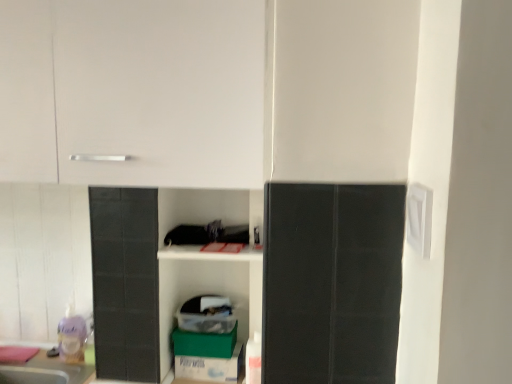
Question: Is white matte cabinet at upper left beside translucent plastic toy at lower left?

Choices:
 (A) yes
 (B) no

Answer: (B)

Question: From a real-world perspective, is white matte cabinet at upper left on top of translucent plastic toy at lower left?

Choices:
 (A) no
 (B) yes

Answer: (B)

Question: Does white matte cabinet at upper left have a lesser height compared to translucent plastic toy at lower left?

Choices:
 (A) yes
 (B) no

Answer: (B)

Question: Could you tell me if white matte cabinet at upper left is facing translucent plastic toy at lower left?

Choices:
 (A) yes
 (B) no

Answer: (B)

Question: Is white matte cabinet at upper left further to camera compared to translucent plastic toy at lower left?

Choices:
 (A) yes
 (B) no

Answer: (B)

Question: Looking at the image, does translucent plastic toy at lower left seem bigger or smaller compared to white matte cabinet at upper left?

Choices:
 (A) big
 (B) small

Answer: (B)

Question: Is translucent plastic toy at lower left in front of or behind white matte cabinet at upper left in the image?

Choices:
 (A) front
 (B) behind

Answer: (B)

Question: Considering the positions of point (72, 312) and point (103, 89), is point (72, 312) closer or farther from the camera than point (103, 89)?

Choices:
 (A) farther
 (B) closer

Answer: (A)

Question: Visually, is translucent plastic toy at lower left positioned to the left or to the right of white matte cabinet at upper left?

Choices:
 (A) right
 (B) left

Answer: (B)

Question: Considering the positions of green cardboard box at lower center, the second cardboard box from the top, and white matte cabinet at upper left in the image, is green cardboard box at lower center, the second cardboard box from the top, bigger or smaller than white matte cabinet at upper left?

Choices:
 (A) small
 (B) big

Answer: (A)

Question: In terms of height, does green cardboard box at lower center, positioned as the first cardboard box in bottom-to-top order, look taller or shorter compared to white matte cabinet at upper left?

Choices:
 (A) short
 (B) tall

Answer: (A)

Question: From the image's perspective, is green cardboard box at lower center, positioned as the first cardboard box in bottom-to-top order, above or below white matte cabinet at upper left?

Choices:
 (A) below
 (B) above

Answer: (A)

Question: Considering their positions, is green cardboard box at lower center, the second cardboard box from the top, located in front of or behind white matte cabinet at upper left?

Choices:
 (A) behind
 (B) front

Answer: (A)

Question: From their relative heights in the image, would you say white matte cabinet at upper left is taller or shorter than green cardboard box at lower center, positioned as the first cardboard box in bottom-to-top order?

Choices:
 (A) tall
 (B) short

Answer: (A)

Question: From a real-world perspective, is white matte cabinet at upper left above or below green cardboard box at lower center, positioned as the first cardboard box in bottom-to-top order?

Choices:
 (A) above
 (B) below

Answer: (A)